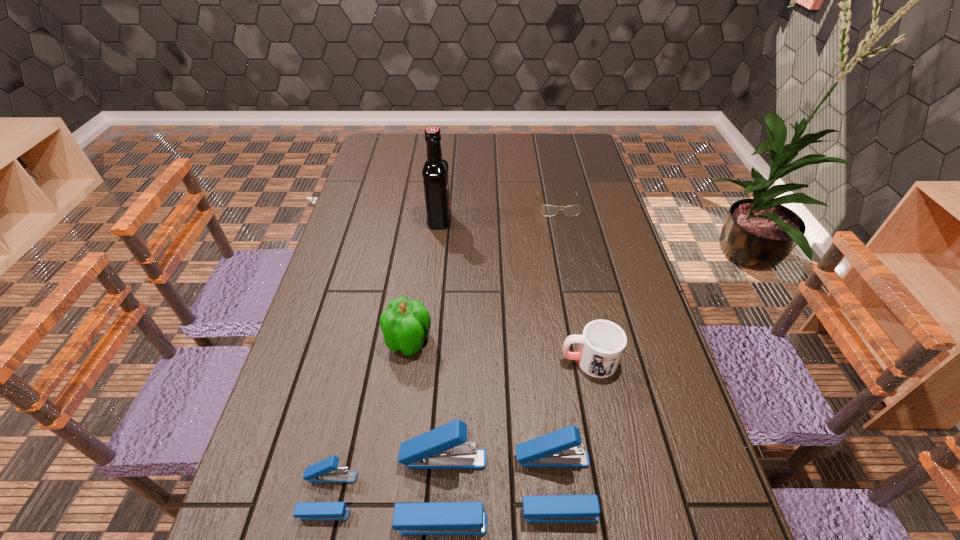
Locate an element on the screen. The height and width of the screenshot is (540, 960). vacant space located 0.180m on the right of the second stapler from right to left is located at coordinates (578, 490).

Find the location of `free space located on the left of the second tallest stapler`. free space located on the left of the second tallest stapler is located at coordinates (406, 485).

The width and height of the screenshot is (960, 540). I want to click on free space located on the front-facing side of the tallest object, so click(565, 221).

The image size is (960, 540). Find the location of `vacant space located 0.240m on the front-facing side of the spectacles`. vacant space located 0.240m on the front-facing side of the spectacles is located at coordinates (570, 266).

At what (x,y) coordinates should I click in order to perform the action: click on free space located 0.170m on the back of the bell pepper. Please return your answer as a coordinate pair (x, y). Looking at the image, I should click on (418, 278).

What are the coordinates of `vacant space situated on the side of the mug with the handle` in the screenshot? It's located at (459, 361).

At what (x,y) coordinates should I click in order to perform the action: click on free spot located on the side of the mug with the handle. Please return your answer as a coordinate pair (x, y). This screenshot has height=540, width=960. Looking at the image, I should click on (430, 361).

You are a GUI agent. You are given a task and a screenshot of the screen. Output one action in this format:
    pyautogui.click(x=<x>, y=<y>)
    Task: Click on the free space located 0.210m on the side of the mug with the handle
    
    Given the screenshot: What is the action you would take?
    pyautogui.click(x=475, y=361)

This screenshot has height=540, width=960. I want to click on object at the left edge, so click(x=325, y=471).

Where is `spectacles that is at the right edge`? This screenshot has width=960, height=540. spectacles that is at the right edge is located at coordinates (546, 210).